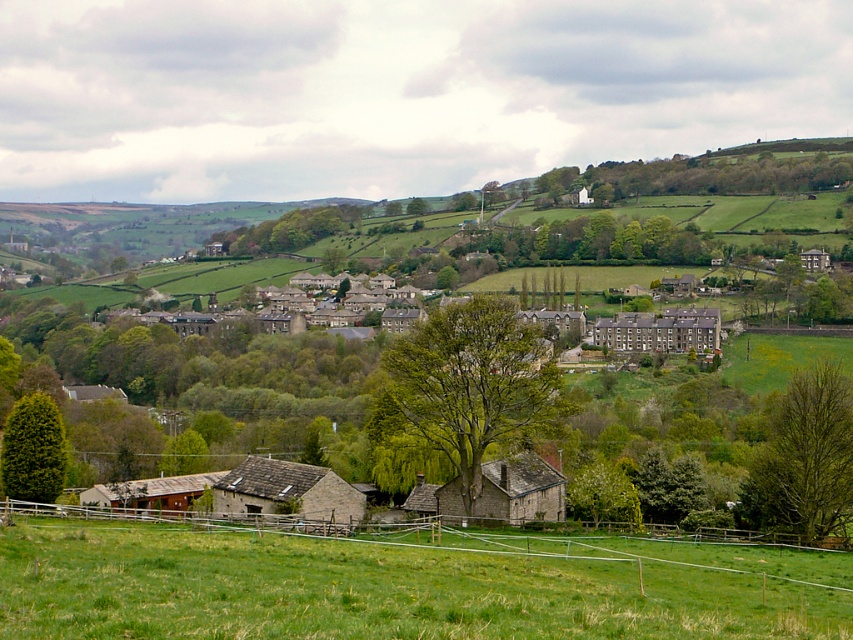
Based on the photo, is green grassy field at lower center closer to the viewer compared to green leafy tree at lower left?

Yes, green grassy field at lower center is closer to the viewer.

Does point (660, 620) lie in front of point (0, 456)?

Yes, point (660, 620) is closer to viewer.

Is point (537, 589) more distant than point (35, 497)?

No, it is in front of (35, 497).

Locate an element on the screen. green grassy field at lower center is located at coordinates (396, 586).

Is green leafy tree at center bigger than green leafy tree at center-right?

No, green leafy tree at center is not bigger than green leafy tree at center-right.

Who is shorter, green leafy tree at center or green leafy tree at center-right?

green leafy tree at center-right is shorter.

Which is behind, point (512, 321) or point (815, 420)?

The point (815, 420) is more distant.

Find the location of a particular element. green leafy tree at center is located at coordinates (474, 384).

Between green grassy field at lower center and green leafy tree at center, which one is positioned higher?

Positioned higher is green leafy tree at center.

Between green grassy field at lower center and green leafy tree at center, which one has less height?

green grassy field at lower center is shorter.

Is point (271, 625) positioned after point (386, 369)?

No, (271, 625) is in front of (386, 369).

This screenshot has width=853, height=640. I want to click on green grassy field at lower center, so click(396, 586).